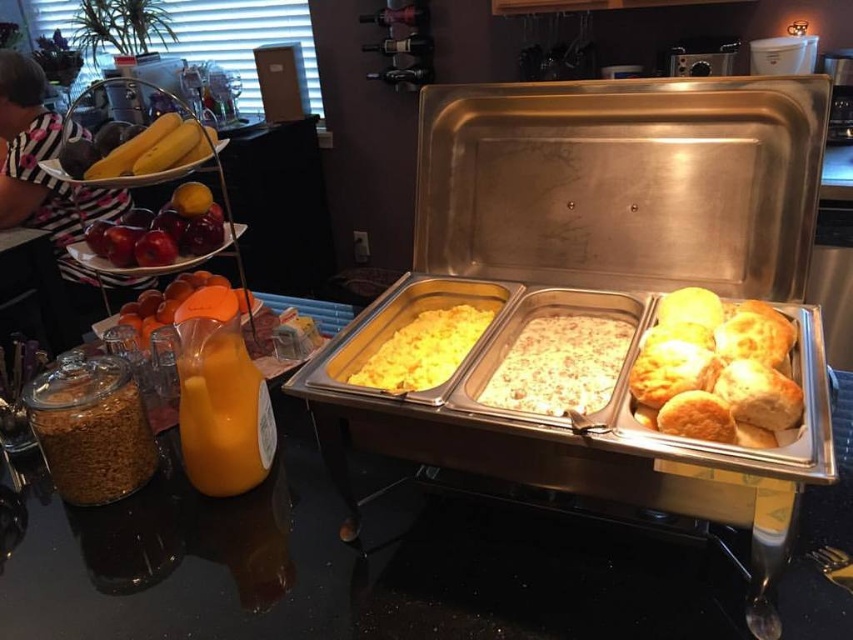
Question: Can you confirm if translucent plastic bottle at lower left is thinner than white creamy casserole at center?

Choices:
 (A) no
 (B) yes

Answer: (B)

Question: Does translucent plastic bottle at lower left appear on the left side of translucent orange juice at left?

Choices:
 (A) yes
 (B) no

Answer: (B)

Question: Estimate the real-world distances between objects in this image. Which object is farther from the yellow matte scrambled eggs at center?

Choices:
 (A) white creamy casserole at center
 (B) shiny red apples at left

Answer: (B)

Question: Can you confirm if white creamy casserole at center is bigger than shiny red apples at left?

Choices:
 (A) no
 (B) yes

Answer: (B)

Question: Which object appears closest to the camera in this image?

Choices:
 (A) white creamy casserole at center
 (B) shiny red apples at left
 (C) yellow matte scrambled eggs at center

Answer: (A)

Question: Which of the following is the farthest from the observer?

Choices:
 (A) translucent plastic bottle at lower left
 (B) yellow matte scrambled eggs at center
 (C) white creamy casserole at center
 (D) shiny red apples at left

Answer: (D)